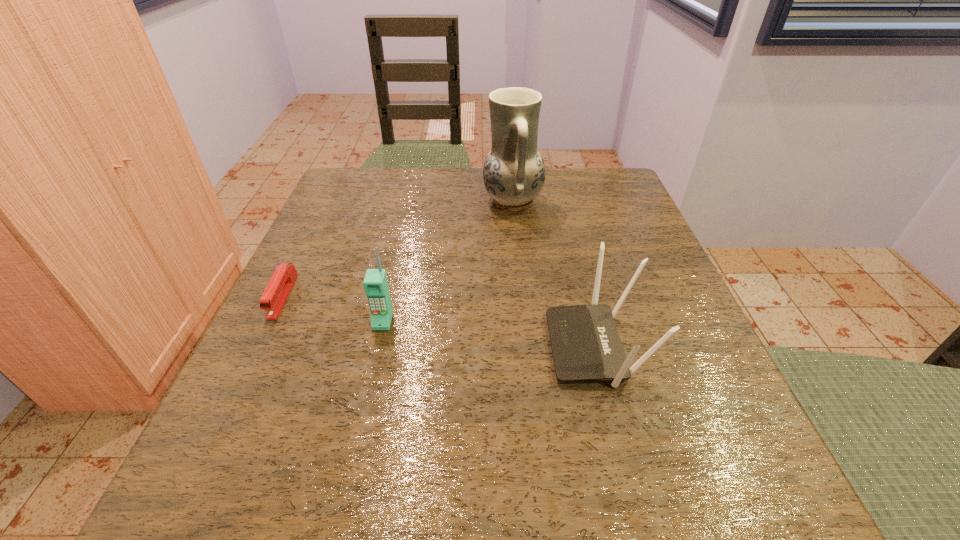
Where is `free space located on the front-facing side of the router`? Image resolution: width=960 pixels, height=540 pixels. free space located on the front-facing side of the router is located at coordinates (305, 347).

This screenshot has height=540, width=960. I want to click on vacant space located on the front-facing side of the shortest object, so click(x=255, y=353).

Identify the location of object present at the far edge. (514, 172).

Locate an element on the screen. object at the left edge is located at coordinates (277, 291).

Locate an element on the screen. The width and height of the screenshot is (960, 540). object located in the right edge section of the desktop is located at coordinates pyautogui.click(x=585, y=343).

Identify the location of free space at the far edge of the desktop. Image resolution: width=960 pixels, height=540 pixels. (562, 198).

This screenshot has height=540, width=960. I want to click on free space at the left edge, so click(369, 263).

This screenshot has height=540, width=960. In the image, there is a desktop. Identify the location of vacant space at the right edge. (661, 392).

In the image, there is a desktop. Where is `vacant space at the far left corner`? The image size is (960, 540). vacant space at the far left corner is located at coordinates (369, 187).

Locate an element on the screen. vacant space at the far right corner of the desktop is located at coordinates (579, 178).